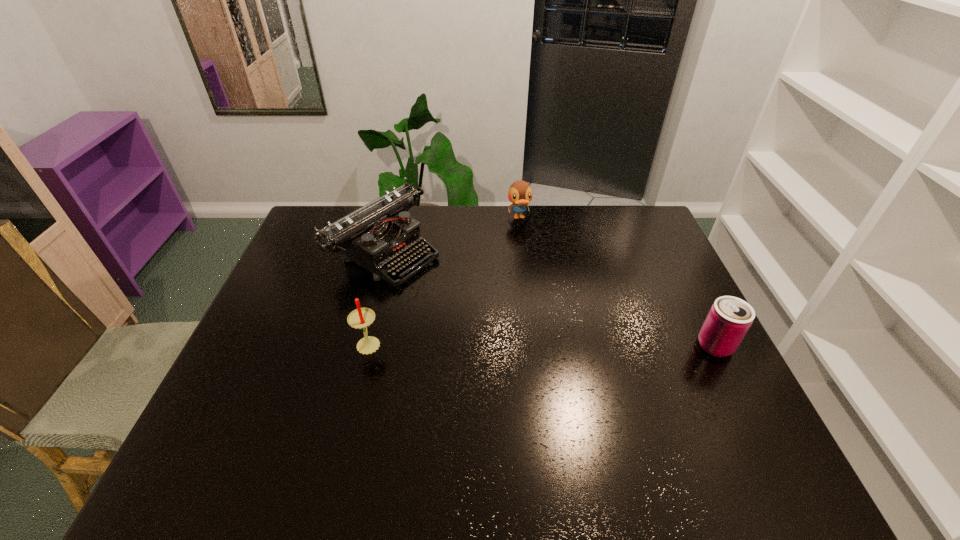
Find the location of a particular element. This screenshot has height=540, width=960. vacant space located on the keyboard of the typewriter is located at coordinates (503, 318).

Identify the location of vacant area situated on the keyboard of the typewriter. This screenshot has height=540, width=960. click(440, 283).

You are a GUI agent. You are given a task and a screenshot of the screen. Output one action in this format:
    pyautogui.click(x=<x>, y=<y>)
    Task: Click on the duck at the far edge
    
    Given the screenshot: What is the action you would take?
    pyautogui.click(x=520, y=194)

Identify the location of typewriter positioned at the far edge. The width and height of the screenshot is (960, 540). (379, 235).

Locate an element on the screen. object at the left edge is located at coordinates (379, 235).

This screenshot has height=540, width=960. Find the location of `object that is at the right edge`. object that is at the right edge is located at coordinates (729, 319).

Where is `object present at the far left corner`? object present at the far left corner is located at coordinates (379, 235).

In the image, there is a desktop. Where is `vacant space at the far edge`? This screenshot has width=960, height=540. vacant space at the far edge is located at coordinates (473, 235).

The height and width of the screenshot is (540, 960). Identify the location of vacant area at the left edge of the desktop. (284, 274).

Where is `free space at the right edge`? The width and height of the screenshot is (960, 540). free space at the right edge is located at coordinates (712, 393).